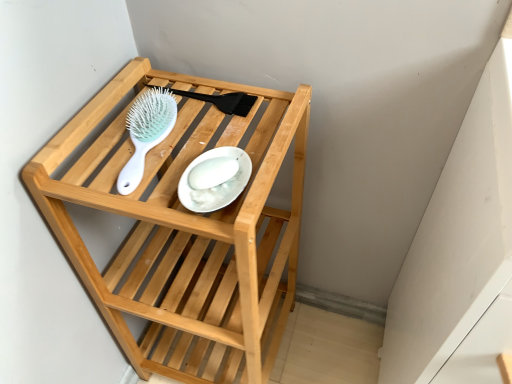
Question: Would you say natural wood shelf at center contains white glossy plate at center?

Choices:
 (A) no
 (B) yes

Answer: (B)

Question: Considering the relative positions of natural wood shelf at center and white glossy plate at center in the image provided, is natural wood shelf at center in front of white glossy plate at center?

Choices:
 (A) no
 (B) yes

Answer: (B)

Question: From a real-world perspective, is natural wood shelf at center under white glossy plate at center?

Choices:
 (A) no
 (B) yes

Answer: (B)

Question: Is natural wood shelf at center wider than white glossy plate at center?

Choices:
 (A) yes
 (B) no

Answer: (A)

Question: Is natural wood shelf at center next to white glossy plate at center?

Choices:
 (A) no
 (B) yes

Answer: (A)

Question: Is natural wood shelf at center outside of white glossy plate at center?

Choices:
 (A) yes
 (B) no

Answer: (A)

Question: Does natural wood shelf at center have a smaller size compared to light blue plastic hairbrush at upper center?

Choices:
 (A) yes
 (B) no

Answer: (B)

Question: From the image's perspective, is natural wood shelf at center below light blue plastic hairbrush at upper center?

Choices:
 (A) yes
 (B) no

Answer: (A)

Question: Does natural wood shelf at center have a lesser height compared to light blue plastic hairbrush at upper center?

Choices:
 (A) no
 (B) yes

Answer: (A)

Question: Considering the relative sizes of natural wood shelf at center and light blue plastic hairbrush at upper center in the image provided, is natural wood shelf at center wider than light blue plastic hairbrush at upper center?

Choices:
 (A) no
 (B) yes

Answer: (B)

Question: From a real-world perspective, is natural wood shelf at center positioned over light blue plastic hairbrush at upper center based on gravity?

Choices:
 (A) no
 (B) yes

Answer: (A)

Question: Is natural wood shelf at center in contact with light blue plastic hairbrush at upper center?

Choices:
 (A) yes
 (B) no

Answer: (B)

Question: Does light blue plastic hairbrush at upper center have a smaller size compared to white glossy plate at center?

Choices:
 (A) no
 (B) yes

Answer: (A)